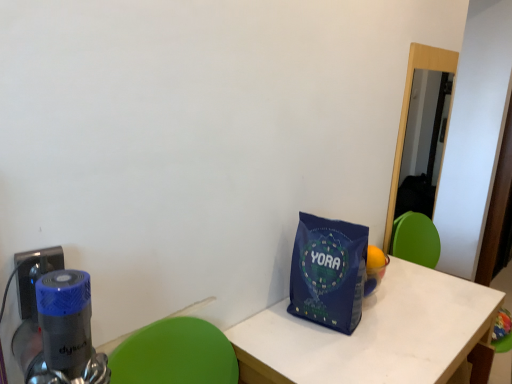
Question: Is white matte table at center far from blue fabric tote bag at lower right?

Choices:
 (A) yes
 (B) no

Answer: (B)

Question: Is white matte table at center in front of blue fabric tote bag at lower right?

Choices:
 (A) yes
 (B) no

Answer: (A)

Question: Considering the relative sizes of white matte table at center and blue fabric tote bag at lower right in the image provided, is white matte table at center thinner than blue fabric tote bag at lower right?

Choices:
 (A) no
 (B) yes

Answer: (A)

Question: Is white matte table at center oriented away from blue fabric tote bag at lower right?

Choices:
 (A) no
 (B) yes

Answer: (A)

Question: Is white matte table at center bigger than blue fabric tote bag at lower right?

Choices:
 (A) yes
 (B) no

Answer: (A)

Question: Can you confirm if white matte table at center is shorter than blue fabric tote bag at lower right?

Choices:
 (A) yes
 (B) no

Answer: (B)

Question: Is blue plastic electric outlet at lower left wider than white matte table at center?

Choices:
 (A) yes
 (B) no

Answer: (B)

Question: Would you say blue plastic electric outlet at lower left contains white matte table at center?

Choices:
 (A) no
 (B) yes

Answer: (A)

Question: From the image's perspective, is blue plastic electric outlet at lower left located beneath white matte table at center?

Choices:
 (A) no
 (B) yes

Answer: (A)

Question: From the image's perspective, is blue plastic electric outlet at lower left on white matte table at center?

Choices:
 (A) yes
 (B) no

Answer: (A)

Question: Is blue plastic electric outlet at lower left facing towards white matte table at center?

Choices:
 (A) no
 (B) yes

Answer: (A)

Question: Is blue plastic electric outlet at lower left closer to the viewer compared to white matte table at center?

Choices:
 (A) no
 (B) yes

Answer: (B)

Question: Is blue fabric tote bag at lower right facing towards blue plastic electric outlet at lower left?

Choices:
 (A) no
 (B) yes

Answer: (A)